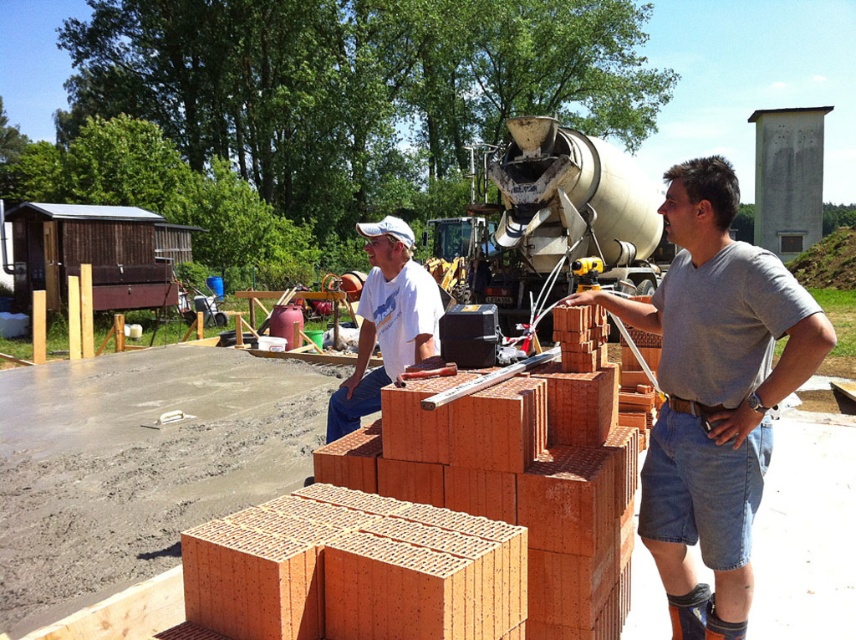
Does smooth concrete at lower left have a lesser width compared to white cotton shirt at center?

Correct, smooth concrete at lower left's width is less than white cotton shirt at center's.

Can you confirm if smooth concrete at lower left is positioned below white cotton shirt at center?

Yes.

Who is more distant from viewer, (251, 458) or (429, 278)?

A: The point (251, 458) is behind.

Identify the location of smooth concrete at lower left. The height and width of the screenshot is (640, 856). [x=137, y=465].

Which is more to the right, matte gray shirt at center or white cotton shirt at center?

Positioned to the right is matte gray shirt at center.

Does matte gray shirt at center have a lesser height compared to white cotton shirt at center?

In fact, matte gray shirt at center may be taller than white cotton shirt at center.

Is point (807, 320) closer to camera compared to point (431, 291)?

Yes, point (807, 320) is in front of point (431, 291).

At what (x,y) coordinates should I click in order to perform the action: click on matte gray shirt at center. Please return your answer as a coordinate pair (x, y). Looking at the image, I should click on (714, 394).

Image resolution: width=856 pixels, height=640 pixels. What do you see at coordinates (137, 465) in the screenshot?
I see `smooth concrete at lower left` at bounding box center [137, 465].

Which of these two, smooth concrete at lower left or matte gray shirt at center, stands shorter?

smooth concrete at lower left

The width and height of the screenshot is (856, 640). Find the location of `smooth concrete at lower left`. smooth concrete at lower left is located at coordinates (137, 465).